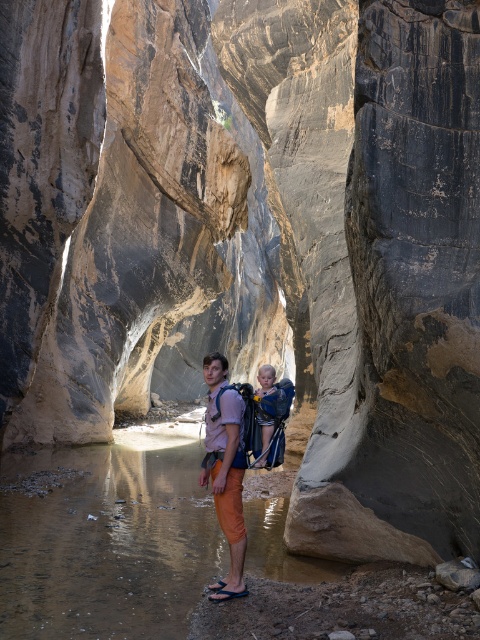
Can you confirm if brown smooth river at center is positioned to the left of orange cotton shorts at center?

Correct, you'll find brown smooth river at center to the left of orange cotton shorts at center.

Does point (6, 458) come closer to viewer compared to point (235, 593)?

No, (6, 458) is behind (235, 593).

Image resolution: width=480 pixels, height=640 pixels. I want to click on brown smooth river at center, so click(x=106, y=541).

Consider the image. Who is more forward, (12, 589) or (271, 420)?

Positioned in front is point (12, 589).

The width and height of the screenshot is (480, 640). Identify the location of brown smooth river at center. (106, 541).

Which is below, orange cotton shorts at center or blue fabric baby carrier at center?

Positioned lower is orange cotton shorts at center.

Does orange cotton shorts at center appear on the left side of blue fabric baby carrier at center?

Indeed, orange cotton shorts at center is positioned on the left side of blue fabric baby carrier at center.

Who is more forward, (235, 390) or (269, 369)?

Point (235, 390) is more forward.

Identify the location of orange cotton shorts at center. The width and height of the screenshot is (480, 640). click(x=225, y=470).